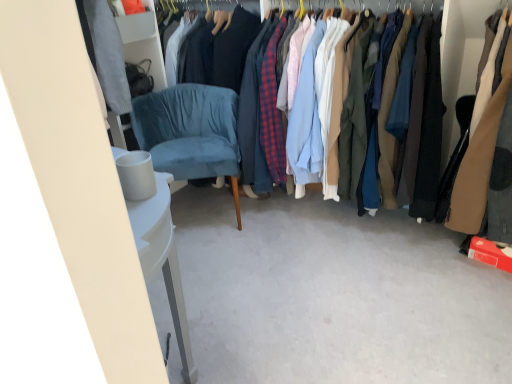
At what (x,y) coordinates should I click in order to perform the action: click on free region under velvet blue armchair at center-left (from a real-world perspective). Please return your answer as a coordinate pair (x, y). Image resolution: width=512 pixels, height=384 pixels. Looking at the image, I should click on (204, 210).